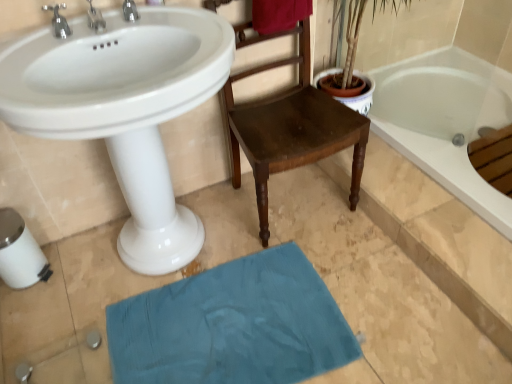
Find the location of `vacant space situated on the left part of silver metallic faucet at upper left, positioned as the 3th tap in right-to-left order`. vacant space situated on the left part of silver metallic faucet at upper left, positioned as the 3th tap in right-to-left order is located at coordinates (26, 41).